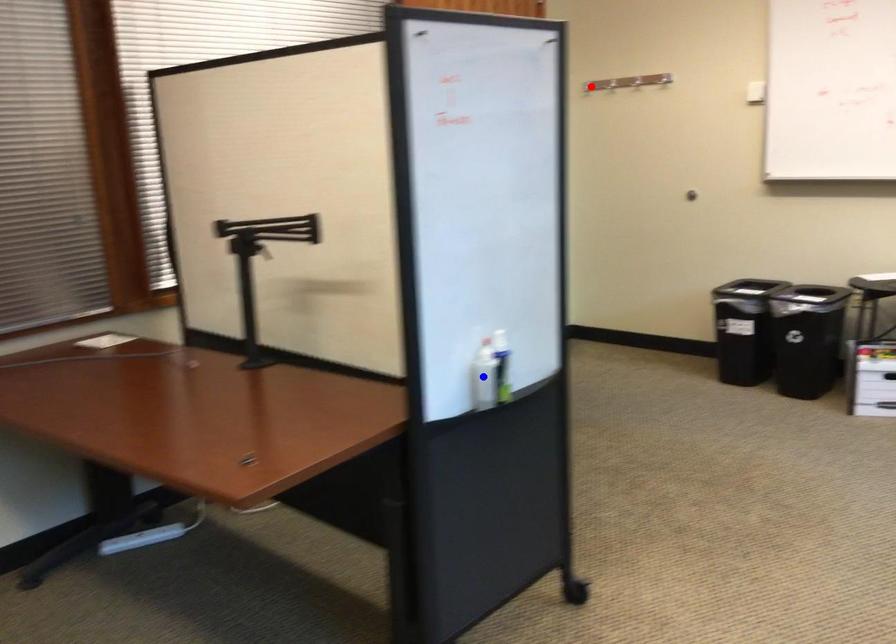
Question: Which of the two points in the image is closer to the camera?

Choices:
 (A) Blue point is closer.
 (B) Red point is closer.

Answer: (A)